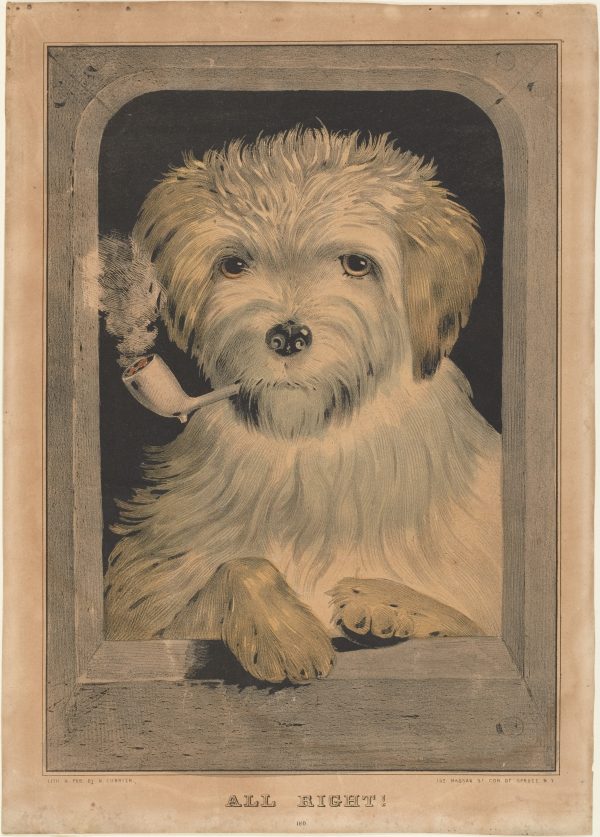
At what (x,y) coordinates should I click in order to perform the action: click on frame. Please return your answer as a coordinate pair (x, y). Looking at the image, I should click on (383, 733).